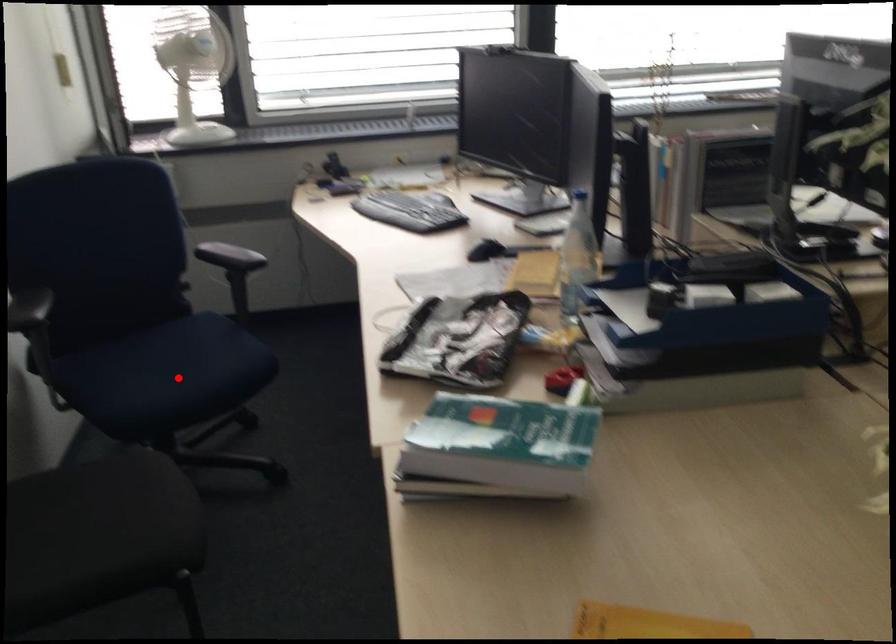
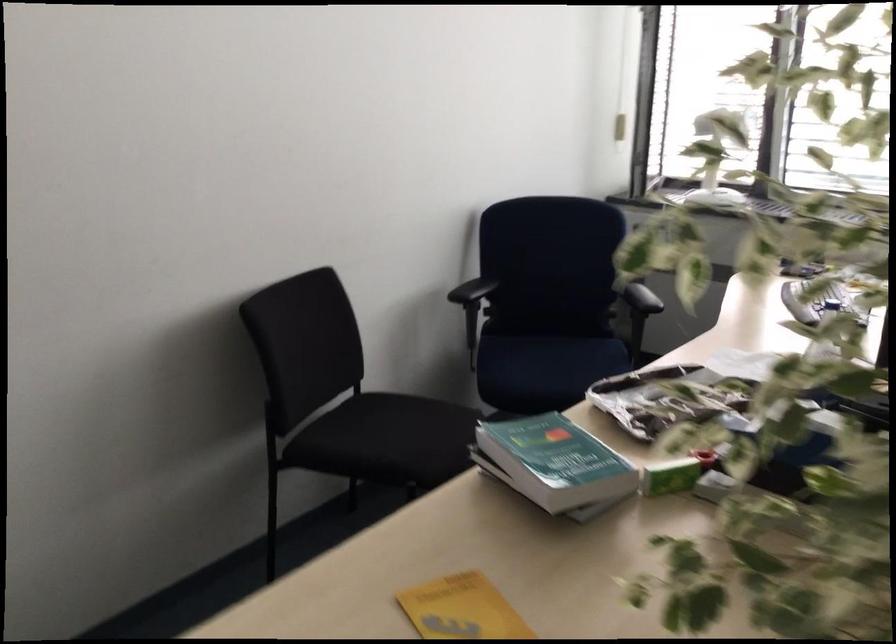
Question: I am providing you with two images of the same scene from different viewpoints. A red point is shown in image1. For the corresponding object point in image2, is it positioned nearer or farther from the camera?

Choices:
 (A) Nearer
 (B) Farther

Answer: (B)